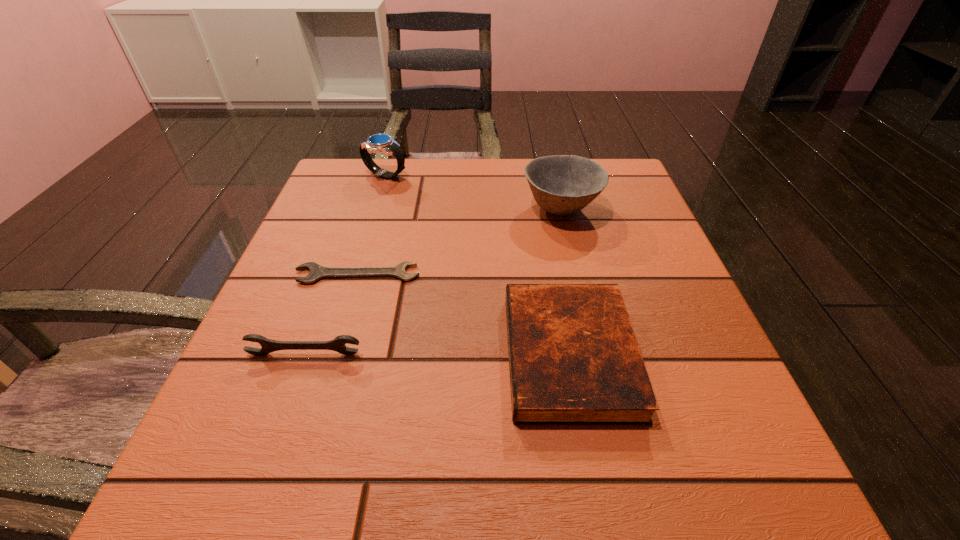
Locate an element on the screen. vacant region between the Bible and the watch is located at coordinates (477, 265).

At what (x,y) coordinates should I click in order to perform the action: click on empty location between the taller wrench and the farthest object. Please return your answer as a coordinate pair (x, y). Looking at the image, I should click on (345, 265).

Identify the location of vacant space that is in between the Bible and the farthest object. (477, 265).

Find the location of a particular element. The width and height of the screenshot is (960, 540). vacant area between the farthest object and the fourth nearest object is located at coordinates (473, 192).

Locate an element on the screen. The image size is (960, 540). unoccupied position between the third nearest object and the bowl is located at coordinates (459, 241).

The width and height of the screenshot is (960, 540). What are the coordinates of `empty space between the taller wrench and the farthest object` in the screenshot? It's located at (345, 265).

Image resolution: width=960 pixels, height=540 pixels. I want to click on free space between the Bible and the farther wrench, so pyautogui.click(x=464, y=315).

Locate which object is the closest to the bowl. Please provide its 2D coordinates. Your answer should be formatted as a tuple, i.e. [(x, y)], where the tuple contains the x and y coordinates of a point satisfying the conditions above.

[(574, 359)]

This screenshot has width=960, height=540. Find the location of `the second closest object to the shorter wrench`. the second closest object to the shorter wrench is located at coordinates (574, 359).

I want to click on free space that satisfies the following two spatial constraints: 1. on the front side of the watch; 2. on the right side of the shorter wrench, so click(355, 274).